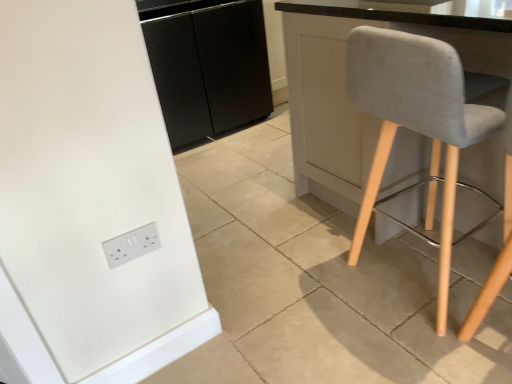
Question: Considering the relative positions of white plastic socket at lower left and black matte cabinet at center in the image provided, is white plastic socket at lower left to the left of black matte cabinet at center from the viewer's perspective?

Choices:
 (A) yes
 (B) no

Answer: (B)

Question: From a real-world perspective, is white plastic socket at lower left physically above black matte cabinet at center?

Choices:
 (A) no
 (B) yes

Answer: (A)

Question: Can you confirm if white plastic socket at lower left is wider than black matte cabinet at center?

Choices:
 (A) no
 (B) yes

Answer: (A)

Question: Can you see white plastic socket at lower left touching black matte cabinet at center?

Choices:
 (A) yes
 (B) no

Answer: (B)

Question: Is white plastic socket at lower left positioned with its back to black matte cabinet at center?

Choices:
 (A) yes
 (B) no

Answer: (B)

Question: Choose the correct answer: Is black matte cabinet at center inside white plastic socket at lower left or outside it?

Choices:
 (A) outside
 (B) inside

Answer: (A)

Question: Does point (232, 36) appear closer or farther from the camera than point (118, 261)?

Choices:
 (A) closer
 (B) farther

Answer: (B)

Question: Would you say black matte cabinet at center is to the left or to the right of white plastic socket at lower left in the picture?

Choices:
 (A) left
 (B) right

Answer: (A)

Question: Considering the positions of black matte cabinet at center and white plastic socket at lower left in the image, is black matte cabinet at center wider or thinner than white plastic socket at lower left?

Choices:
 (A) thin
 (B) wide

Answer: (B)

Question: Looking at their shapes, would you say white plastic socket at lower left is wider or thinner than black matte cabinet at center?

Choices:
 (A) wide
 (B) thin

Answer: (B)

Question: In the image, is white plastic socket at lower left on the left side or the right side of black matte cabinet at center?

Choices:
 (A) right
 (B) left

Answer: (A)

Question: From the image's perspective, is white plastic socket at lower left located above or below black matte cabinet at center?

Choices:
 (A) below
 (B) above

Answer: (A)

Question: Is point (132, 238) positioned closer to the camera than point (228, 91)?

Choices:
 (A) closer
 (B) farther

Answer: (A)

Question: Would you say white plastic socket at lower left is inside or outside light gray fabric chair at right?

Choices:
 (A) inside
 (B) outside

Answer: (B)

Question: From the image's perspective, relative to light gray fabric chair at right, is white plastic socket at lower left above or below?

Choices:
 (A) above
 (B) below

Answer: (B)